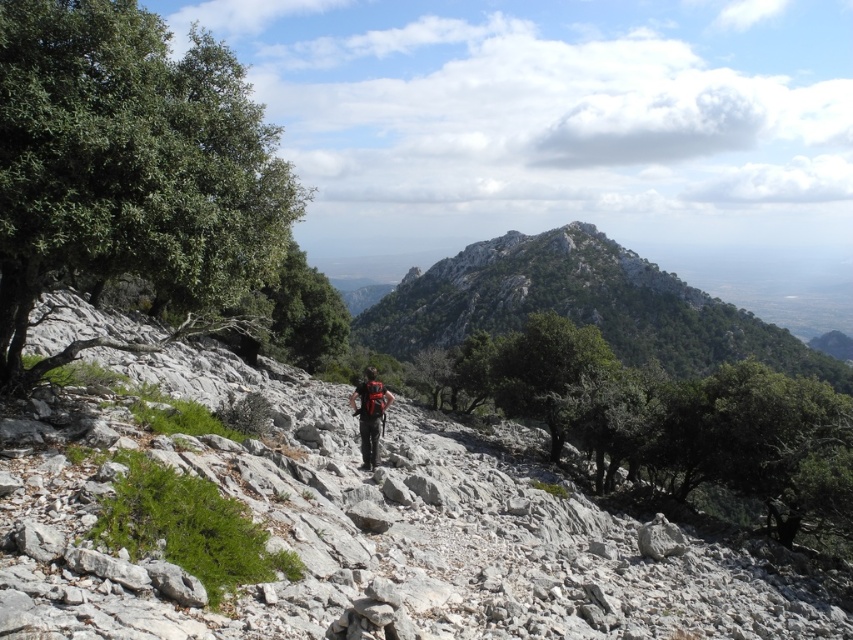
Between green leafy tree at left and matte black backpack at center, which one appears on the left side from the viewer's perspective?

green leafy tree at left

Can you confirm if green leafy tree at left is wider than matte black backpack at center?

Correct, the width of green leafy tree at left exceeds that of matte black backpack at center.

Who is more forward, (170,140) or (366,442)?

Point (170,140) is more forward.

Identify the location of green leafy tree at left. Image resolution: width=853 pixels, height=640 pixels. (128, 164).

Does green rocky mountain at center have a lesser height compared to matte black backpack at center?

No, green rocky mountain at center is not shorter than matte black backpack at center.

Does green rocky mountain at center come behind matte black backpack at center?

Yes, it is.

I want to click on green rocky mountain at center, so click(581, 307).

Is green leafy tree at left thinner than green rocky mountain at center?

Indeed, green leafy tree at left has a lesser width compared to green rocky mountain at center.

Based on the photo, is green leafy tree at left bigger than green rocky mountain at center?

No, green leafy tree at left is not bigger than green rocky mountain at center.

At what (x,y) coordinates should I click in order to perform the action: click on green leafy tree at left. Please return your answer as a coordinate pair (x, y). This screenshot has width=853, height=640. Looking at the image, I should click on (128, 164).